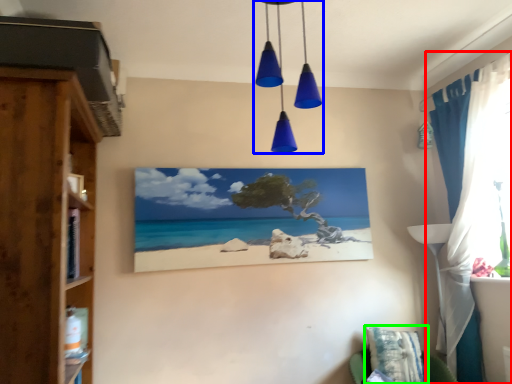
Question: Based on their relative distances, which object is nearer to curtain (highlighted by a red box)? Choose from light fixture (highlighted by a blue box) and pillow (highlighted by a green box).

Choices:
 (A) light fixture
 (B) pillow

Answer: (B)